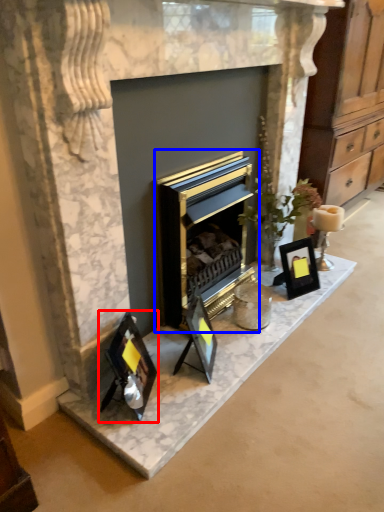
Question: Which object is closer to the camera taking this photo, picture frame (highlighted by a red box) or fireplace (highlighted by a blue box)?

Choices:
 (A) picture frame
 (B) fireplace

Answer: (A)